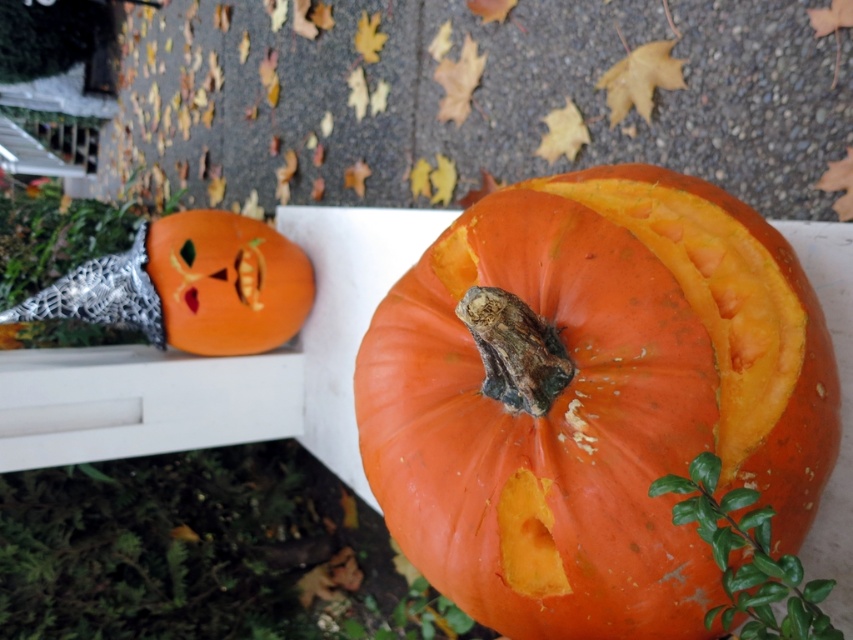
Question: Among these points, which one is nearest to the camera?

Choices:
 (A) (471, 264)
 (B) (180, 298)

Answer: (A)

Question: Among these points, which one is farthest from the camera?

Choices:
 (A) 204,260
 (B) 585,324

Answer: (A)

Question: Can you confirm if orange matte pumpkin at center is positioned above orange matte pumpkin at upper left?

Choices:
 (A) yes
 (B) no

Answer: (B)

Question: Does orange matte pumpkin at center have a smaller size compared to orange matte pumpkin at upper left?

Choices:
 (A) yes
 (B) no

Answer: (B)

Question: Which of the following is the farthest from the observer?

Choices:
 (A) orange matte pumpkin at upper left
 (B) orange matte pumpkin at center

Answer: (A)

Question: Can you confirm if orange matte pumpkin at center is thinner than orange matte pumpkin at upper left?

Choices:
 (A) no
 (B) yes

Answer: (A)